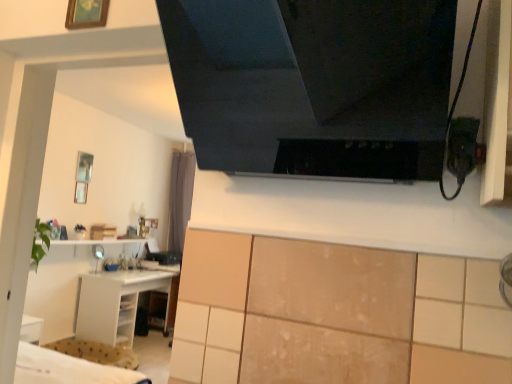
Question: Visually, is white glossy shelf at lower left positioned to the left or to the right of metallic silver picture frame at upper left, which is counted as the first picture frame, starting from the bottom?

Choices:
 (A) left
 (B) right

Answer: (B)

Question: From the image's perspective, is white glossy shelf at lower left positioned above or below metallic silver picture frame at upper left, the 2th picture frame positioned from the right?

Choices:
 (A) below
 (B) above

Answer: (A)

Question: Considering the real-world distances, which object is farthest from the white glossy shelf at lower left?

Choices:
 (A) wooden picture frame at upper left, acting as the second picture frame starting from the bottom
 (B) metallic silver picture frame at upper left, which is counted as the 2th picture frame, starting from the front
 (C) gray fabric curtain at center
 (D) black glossy exhaust hood at upper center

Answer: (D)

Question: Which of these objects is positioned farthest from the wooden picture frame at upper left, acting as the second picture frame starting from the bottom?

Choices:
 (A) white glossy shelf at lower left
 (B) black glossy exhaust hood at upper center
 (C) metallic silver picture frame at upper left, which is counted as the 2th picture frame, starting from the front
 (D) gray fabric curtain at center

Answer: (D)